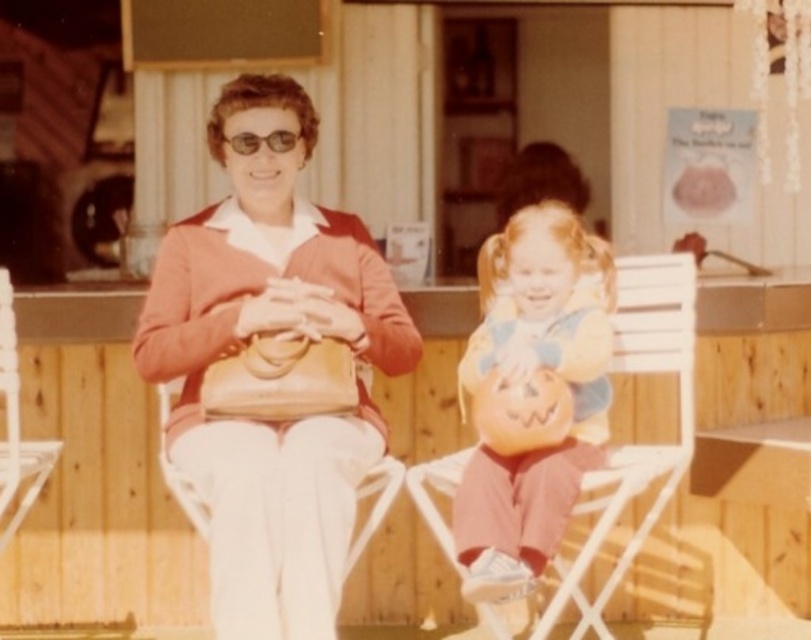
You are a photographer setting up for a portrait. You notice a matte brown purse at center and a white plastic chair at center in the scene. Which object is positioned higher relative to the other?

The matte brown purse at center is above the white plastic chair at center, so it is positioned higher.